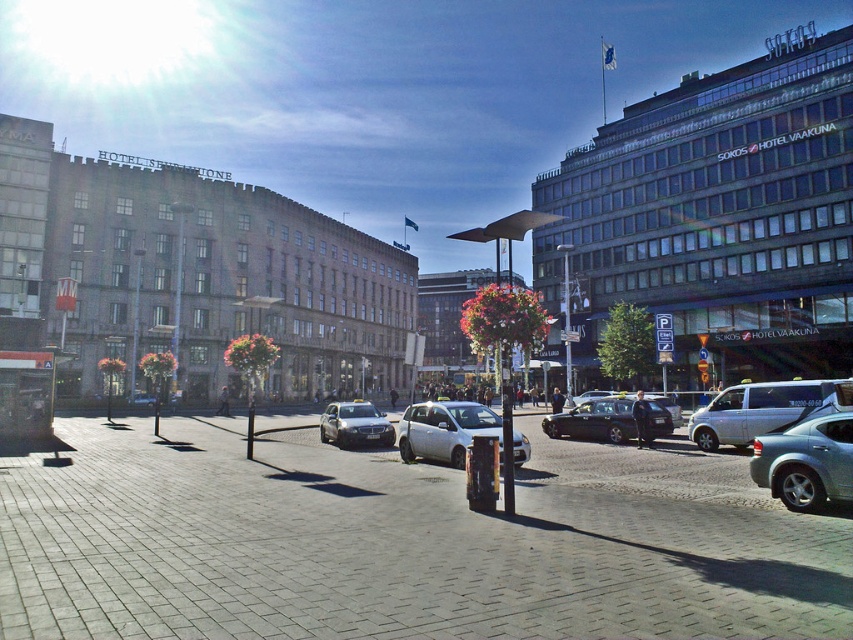
Question: Where is metallic silver sedan at lower right located in relation to silver metallic van at center in the image?

Choices:
 (A) left
 (B) right

Answer: (A)

Question: Based on their relative distances, which object is farther from the silver metallic van at center?

Choices:
 (A) white matte car at center
 (B) metallic silver sedan at lower right
 (C) silver metallic sedan at center
 (D) shiny black sedan at center

Answer: (C)

Question: Does silver metallic van at center appear under shiny black sedan at center?

Choices:
 (A) no
 (B) yes

Answer: (B)

Question: Which of the following is the farthest from the observer?

Choices:
 (A) (374, 428)
 (B) (779, 442)
 (C) (577, 406)
 (D) (466, 433)

Answer: (C)

Question: Is shiny black sedan at center to the right of silver metallic sedan at center from the viewer's perspective?

Choices:
 (A) no
 (B) yes

Answer: (B)

Question: Which point appears farthest from the camera in this image?

Choices:
 (A) (730, 413)
 (B) (410, 458)

Answer: (A)